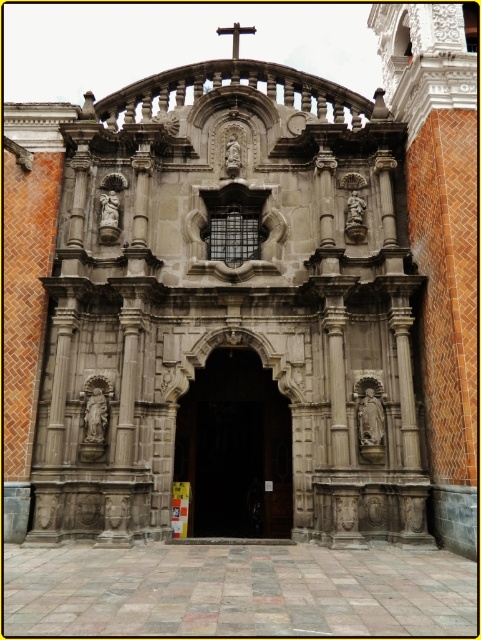
Question: Where is dark wood door at center located in relation to wooden cross at center in the image?

Choices:
 (A) left
 (B) right

Answer: (B)

Question: In this image, where is dark wood door at center located relative to wooden cross at center?

Choices:
 (A) right
 (B) left

Answer: (A)

Question: Is dark wood door at center behind wooden cross at center?

Choices:
 (A) yes
 (B) no

Answer: (B)

Question: Which of the following is the farthest from the observer?

Choices:
 (A) (235, 51)
 (B) (229, 390)

Answer: (A)

Question: Which point is closer to the camera taking this photo?

Choices:
 (A) (251, 33)
 (B) (252, 435)

Answer: (B)